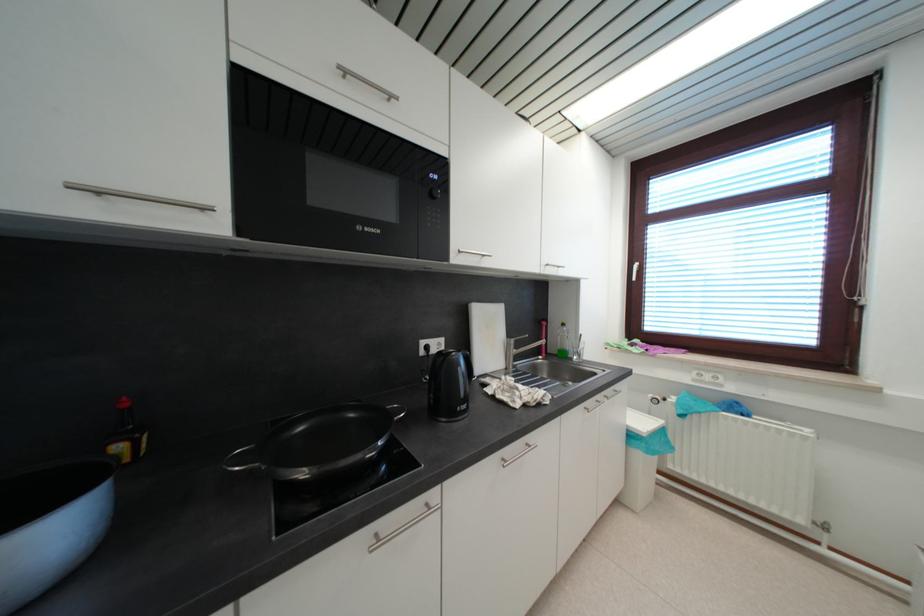
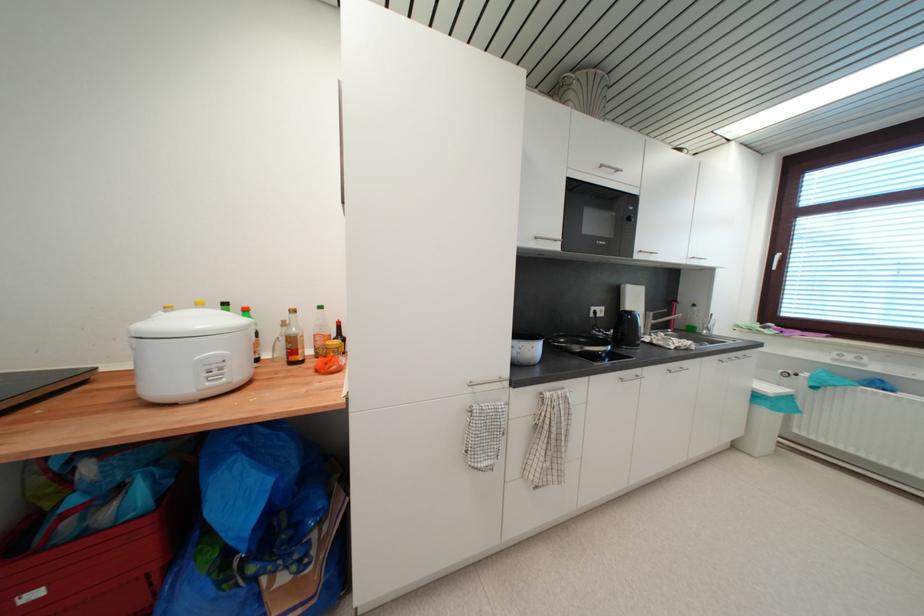
Which direction would the cameraman need to move to produce the second image?

The cameraman moved toward left, backward.